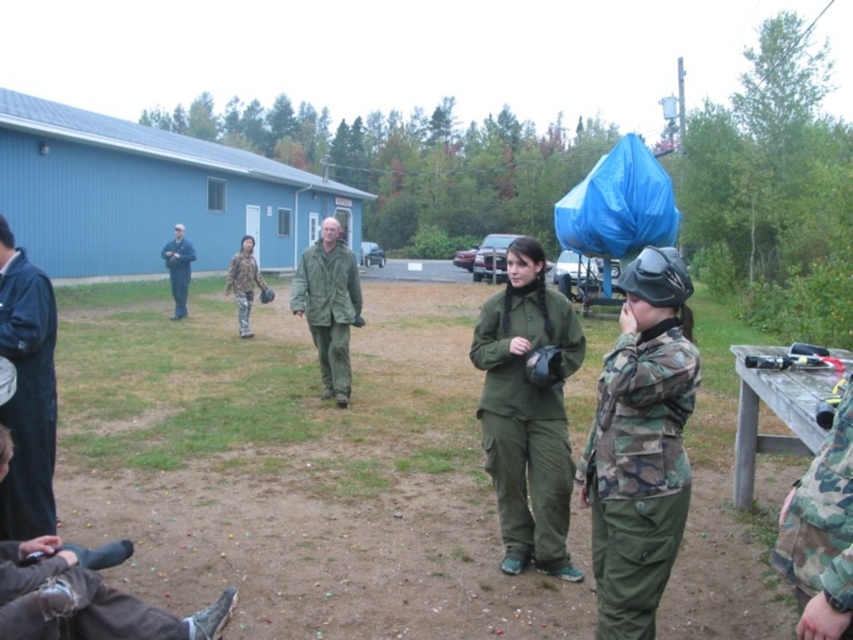
Is brown suede boots at lower left to the left of green matte jacket at center from the viewer's perspective?

Indeed, brown suede boots at lower left is positioned on the left side of green matte jacket at center.

Image resolution: width=853 pixels, height=640 pixels. Identify the location of brown suede boots at lower left. (70, 600).

Is the position of green matte uniform at center less distant than that of camo fabric uniform at right?

No, green matte uniform at center is further to the viewer.

Is green matte uniform at center bigger than camo fabric uniform at right?

Answer: Yes, green matte uniform at center is bigger than camo fabric uniform at right.

Describe the element at coordinates (527, 420) in the screenshot. I see `green matte uniform at center` at that location.

Locate an element on the screen. This screenshot has width=853, height=640. green matte uniform at center is located at coordinates (527, 420).

How far apart are green matte jacket at center and camouflage fabric uniform at center?

green matte jacket at center is 4.63 meters from camouflage fabric uniform at center.

Is green matte jacket at center taller than camouflage fabric uniform at center?

Correct, green matte jacket at center is much taller as camouflage fabric uniform at center.

I want to click on green matte jacket at center, so click(x=329, y=305).